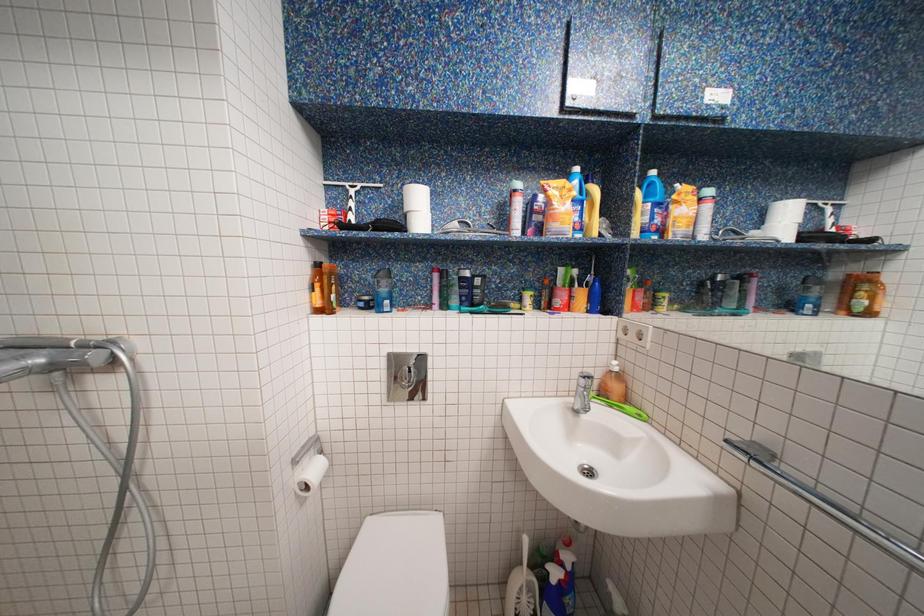
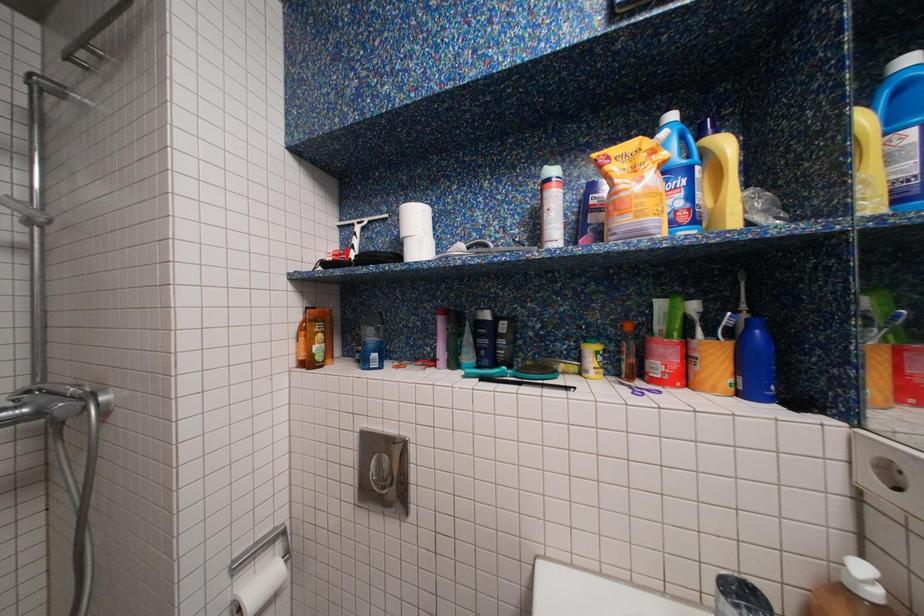
Question: Based on the continuous images, in which direction is the camera rotating? Reply with the corresponding letter.

Choices:
 (A) Left
 (B) Right
 (C) Up
 (D) Down

Answer: (A)